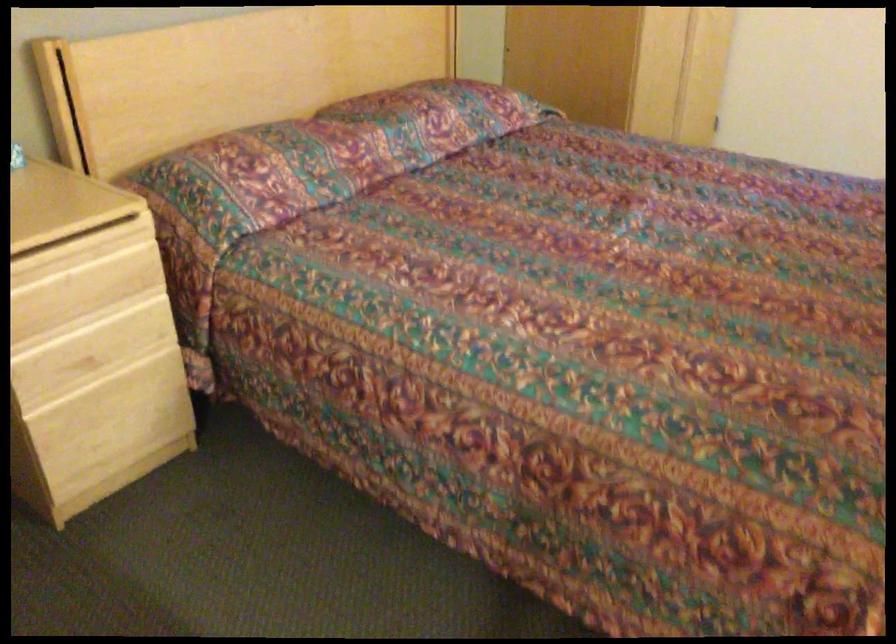
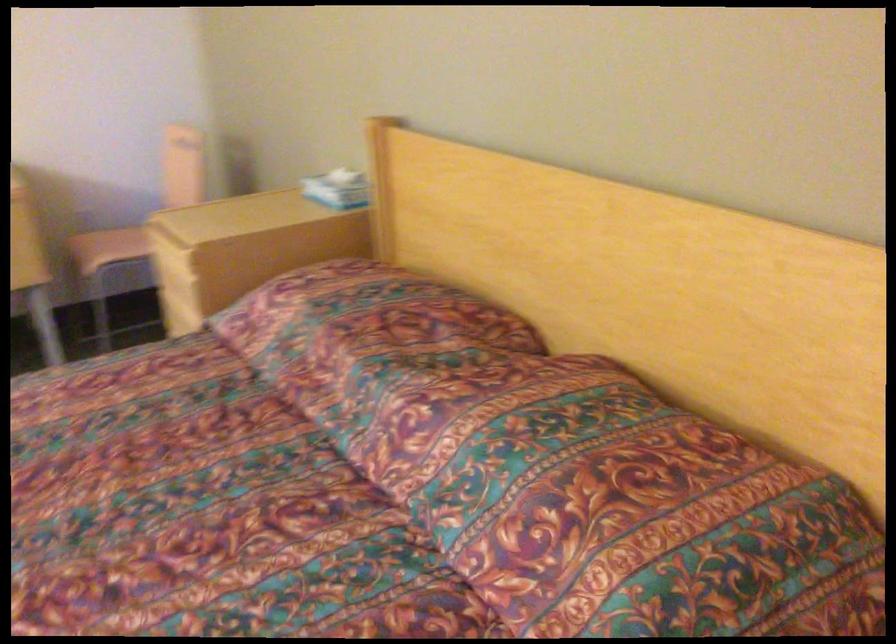
In the second image, find the point that corresponds to point 332,134 in the first image.

(354, 325)